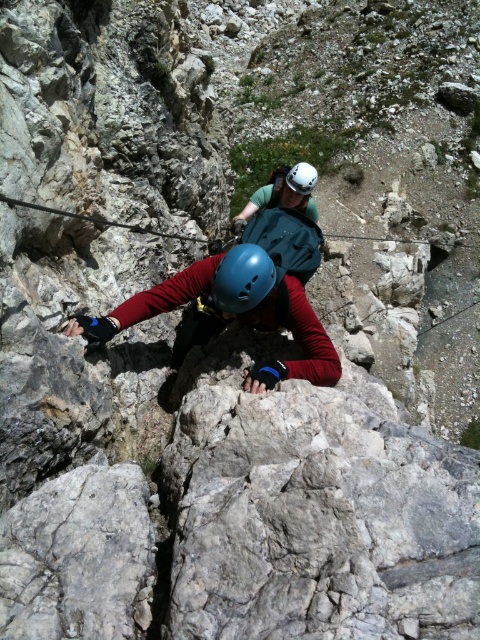
Question: Is blue matte helmet at center thinner than white matte helmet at center?

Choices:
 (A) no
 (B) yes

Answer: (B)

Question: Which point is farther to the camera?

Choices:
 (A) (252, 257)
 (B) (308, 164)

Answer: (B)

Question: Is blue matte helmet at center thinner than white matte helmet at center?

Choices:
 (A) no
 (B) yes

Answer: (B)

Question: Among these points, which one is nearest to the camera?

Choices:
 (A) (253, 253)
 (B) (310, 193)

Answer: (A)

Question: Is blue matte helmet at center to the left of white matte helmet at center from the viewer's perspective?

Choices:
 (A) no
 (B) yes

Answer: (B)

Question: Which point is closer to the camera?

Choices:
 (A) blue matte helmet at center
 (B) white matte helmet at center

Answer: (A)